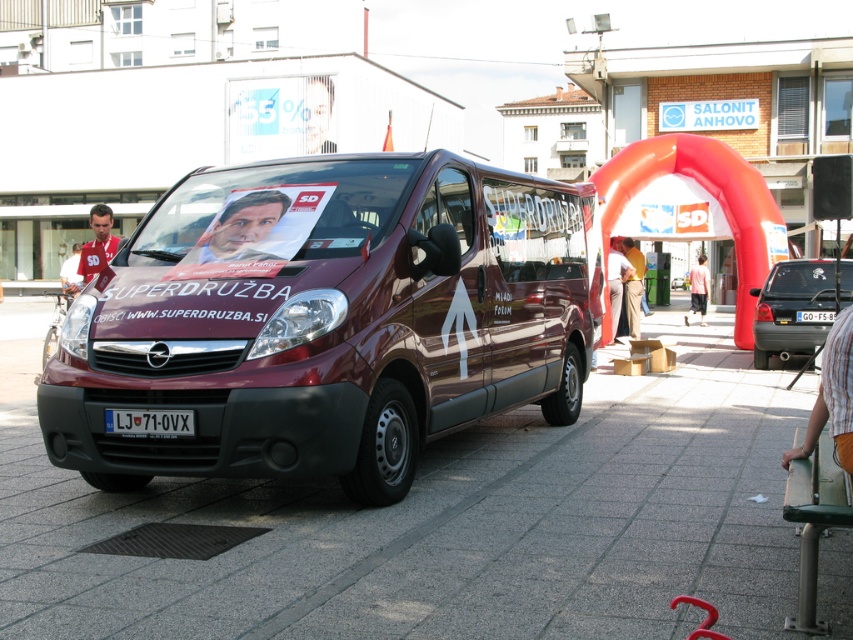
You are a delivery person who needs to deliver a package to the matte black shirt at left and the smooth plastic poster at center. Which object should you deliver to first if you are approaching from the left side of the image?

You should deliver to the matte black shirt at left first because the smooth plastic poster at center is positioned on the right side of the matte black shirt at left, meaning the matte black shirt at left is closer to your approach from the left side.

You are a photographer standing in front of the maroon Opel van with the SUPERDRUZBA decals. You notice two points marked on the van. The first point is at coordinate point (x=210, y=579) and the second is at point (x=793, y=333). Which point is closer to your camera?

The point at coordinate point (x=210, y=579) is closer to the camera than point (x=793, y=333).

You are a delivery person who needs to park your vehicle in a space that can only accommodate items up to the width of the smooth plastic poster at center. Can the matte black van at center fit in this space?

The matte black van at center is wider than the smooth plastic poster at center, so it cannot fit in the space designed for items up to the poster width.